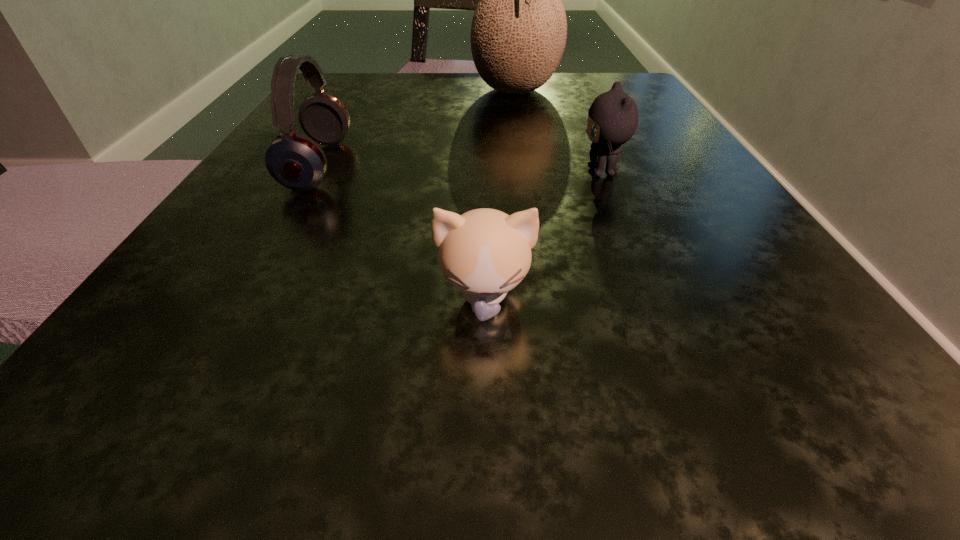
I want to click on free space located 0.230m on the front-facing side of the right kitten, so click(x=416, y=172).

Identify the location of vacant point located on the front-facing side of the right kitten. (437, 172).

Locate an element on the screen. The image size is (960, 540). vacant region located on the face of the nearest object is located at coordinates (486, 396).

Identify the location of object present at the far edge. Image resolution: width=960 pixels, height=540 pixels. (518, 34).

What are the coordinates of `object that is at the left edge` in the screenshot? It's located at (295, 161).

Where is `object positioned at the right edge`? The image size is (960, 540). object positioned at the right edge is located at coordinates (613, 116).

Image resolution: width=960 pixels, height=540 pixels. I want to click on vacant region at the far edge of the desktop, so click(x=404, y=85).

What are the coordinates of `free location at the near edge` in the screenshot? It's located at (629, 368).

Locate an element on the screen. free space at the left edge of the desktop is located at coordinates (172, 339).

The width and height of the screenshot is (960, 540). In the image, there is a desktop. In order to click on free space at the right edge in this screenshot , I will do `click(731, 205)`.